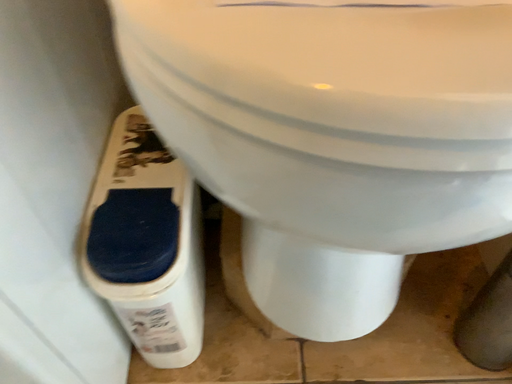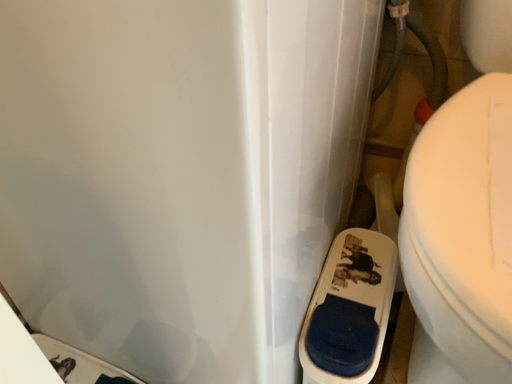
Question: How did the camera likely rotate when shooting the video?

Choices:
 (A) rotated right
 (B) rotated left

Answer: (B)